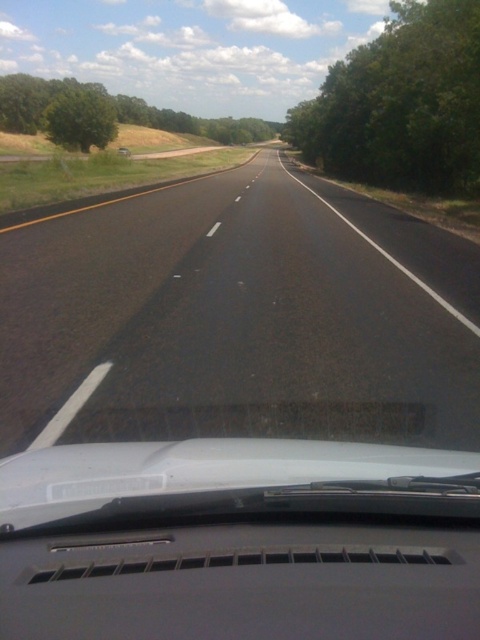
Does point (361, 330) come behind point (1, 122)?

No, (361, 330) is in front of (1, 122).

From the picture: Can you confirm if black asphalt road at center is positioned to the left of green leafy tree at upper center?

No, black asphalt road at center is not to the left of green leafy tree at upper center.

Which is behind, point (74, 225) or point (34, 90)?

The point (34, 90) is more distant.

You are a GUI agent. You are given a task and a screenshot of the screen. Output one action in this format:
    pyautogui.click(x=<x>, y=<y>)
    Task: Click on the black asphalt road at center
    
    Given the screenshot: What is the action you would take?
    pyautogui.click(x=240, y=307)

Which is more to the left, black asphalt road at center or gray matte windshield at center?

From the viewer's perspective, black asphalt road at center appears more on the left side.

Who is positioned more to the right, black asphalt road at center or gray matte windshield at center?

gray matte windshield at center

The image size is (480, 640). What do you see at coordinates (240, 307) in the screenshot?
I see `black asphalt road at center` at bounding box center [240, 307].

Identify the location of black asphalt road at center. (240, 307).

Between gray matte windshield at center and green leafy tree at upper center, which one is positioned lower?

Positioned lower is gray matte windshield at center.

Can you confirm if gray matte windshield at center is bigger than green leafy tree at upper center?

Incorrect, gray matte windshield at center is not larger than green leafy tree at upper center.

Find the location of `gray matte windshield at center`. gray matte windshield at center is located at coordinates (239, 540).